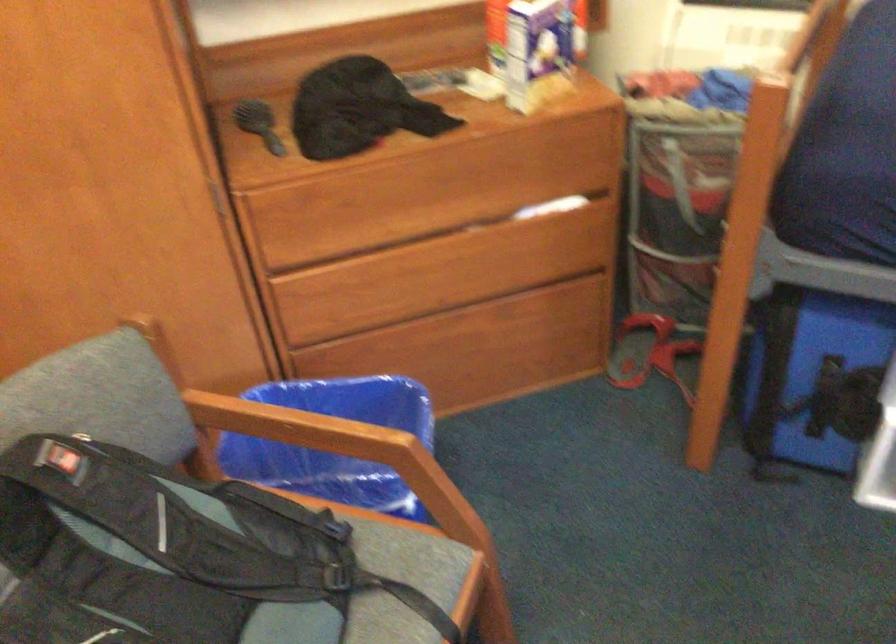
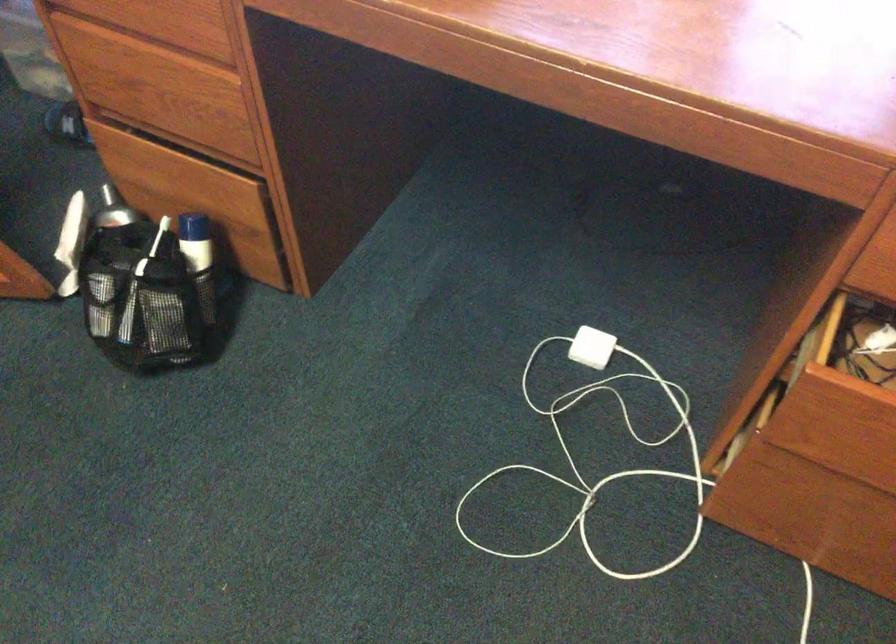
Looking at this image, the first image is from the beginning of the video and the second image is from the end. How did the camera likely rotate when shooting the video?

The camera rotated toward right-down.